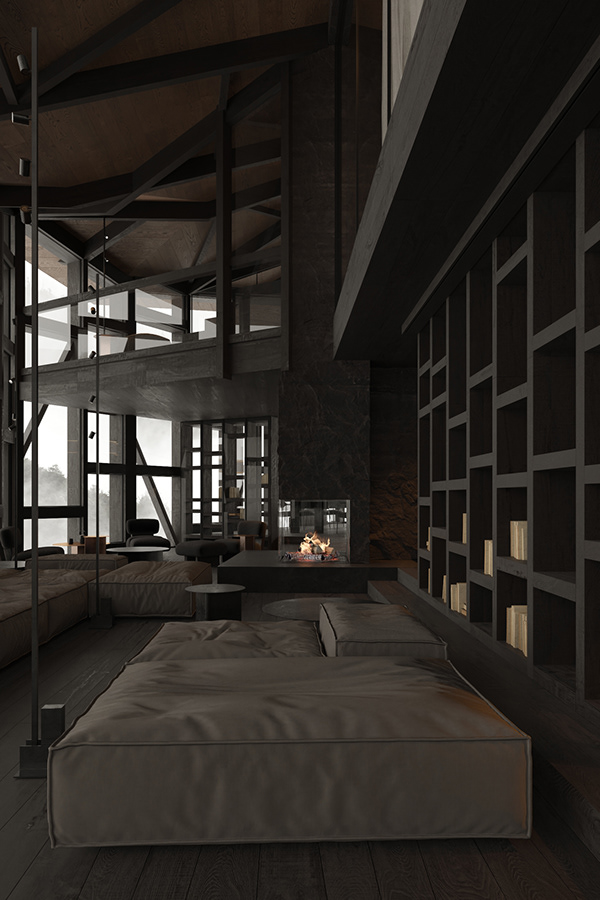
This screenshot has height=900, width=600. I want to click on ceiling, exposed rafters, so click(x=131, y=79), click(x=86, y=51), click(x=204, y=166), click(x=248, y=202), click(x=271, y=237), click(x=121, y=232).